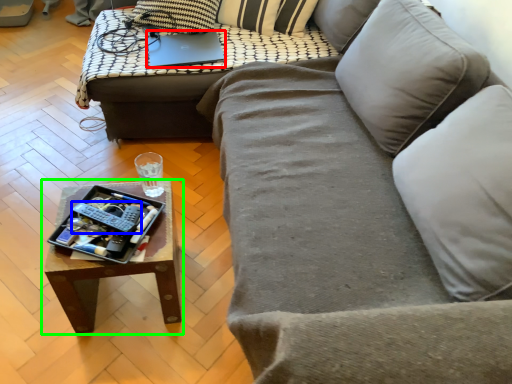
Question: Which is nearer to the laptop (highlighted by a red box)? remote (highlighted by a blue box) or coffee table (highlighted by a green box).

Choices:
 (A) remote
 (B) coffee table

Answer: (B)